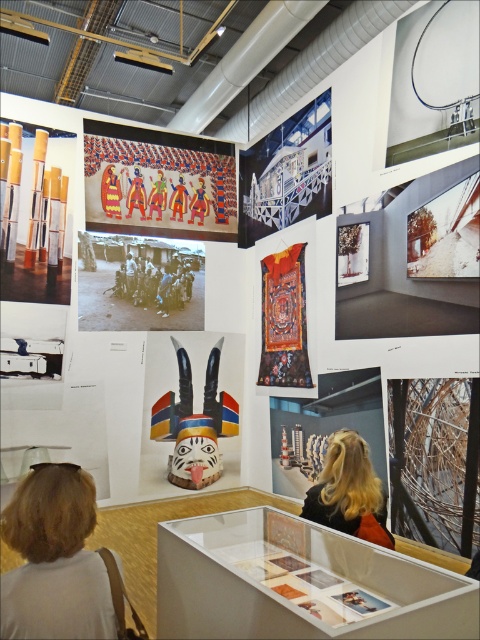
Question: Can you confirm if blonde hair at lower left is smaller than velvet tapestry at center?

Choices:
 (A) no
 (B) yes

Answer: (B)

Question: Which point appears closest to the camera in this image?

Choices:
 (A) (190, 292)
 (B) (54, 544)
 (C) (235, 230)
 (D) (273, 356)

Answer: (B)

Question: Does vivid painted figures at upper center have a smaller size compared to black and white photograph of people at center?

Choices:
 (A) yes
 (B) no

Answer: (B)

Question: Which of these objects is positioned farthest from the black and white photograph of people at center?

Choices:
 (A) wooden painted mask at center
 (B) velvet tapestry at center

Answer: (B)

Question: Does wooden painted mask at center have a lesser width compared to blonde hair at center?

Choices:
 (A) no
 (B) yes

Answer: (A)

Question: Which object appears closest to the camera in this image?

Choices:
 (A) velvet tapestry at center
 (B) blonde hair at lower left

Answer: (B)